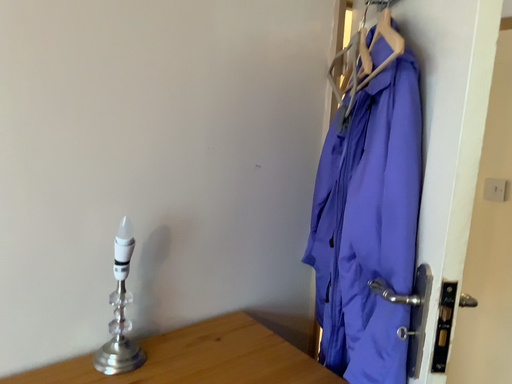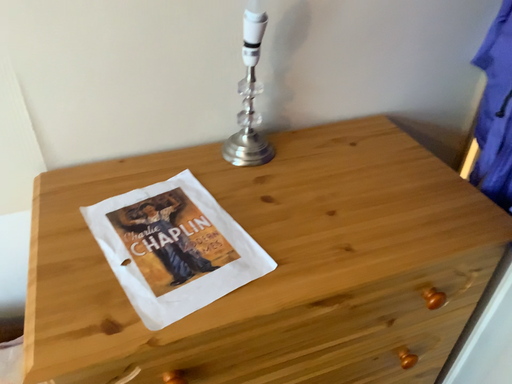
Question: Which way did the camera rotate in the video?

Choices:
 (A) rotated upward
 (B) rotated downward

Answer: (B)